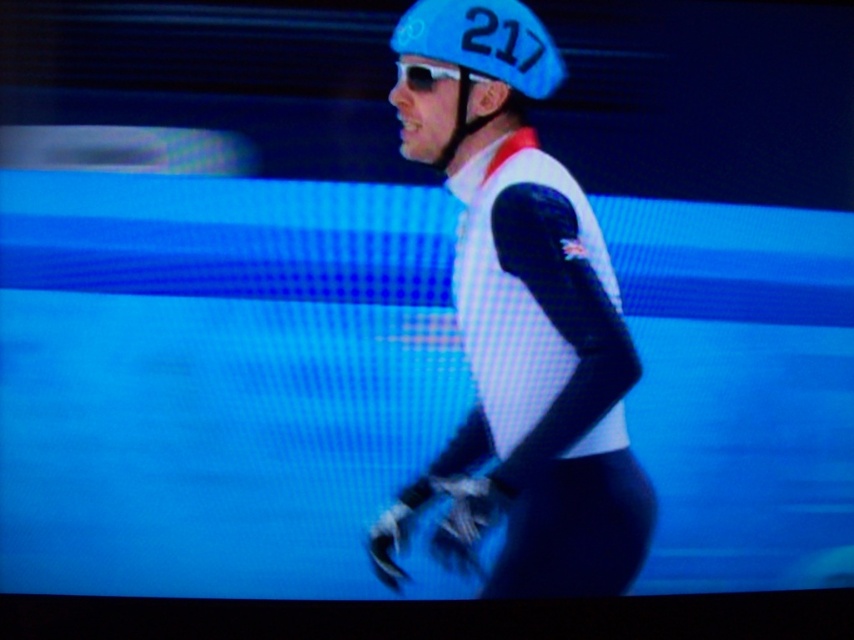
You are a photographer at the event and want to capture a photo where the matte black suit at center and blue matte helmet at upper center are both clearly visible. Based on their positions, which object should you focus on first to ensure both are in frame?

The blue matte helmet at upper center should be focused on first since the matte black suit at center is to the right of it, ensuring both are within the frame by starting from the helmet and adjusting to include the suit.

You are standing at the point labeled as point (496, 67) in a speed skating rink. You want to place a small sensor on the ice that must be exactly 1.67 meters away from your current position. Can you confirm if placing it at your current location would satisfy the requirement?

The point labeled as point (496, 67) and the viewer are 1.67 meters apart. Placing the sensor at your current location would not satisfy the requirement because it needs to be exactly 1.67 meters away from your position, not at the same spot.